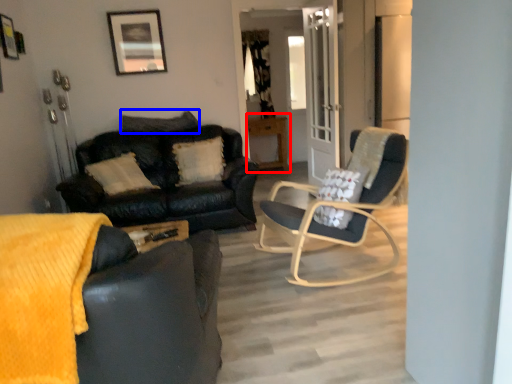
Question: Which object is closer to the camera taking this photo, table (highlighted by a red box) or pillow (highlighted by a blue box)?

Choices:
 (A) table
 (B) pillow

Answer: (B)